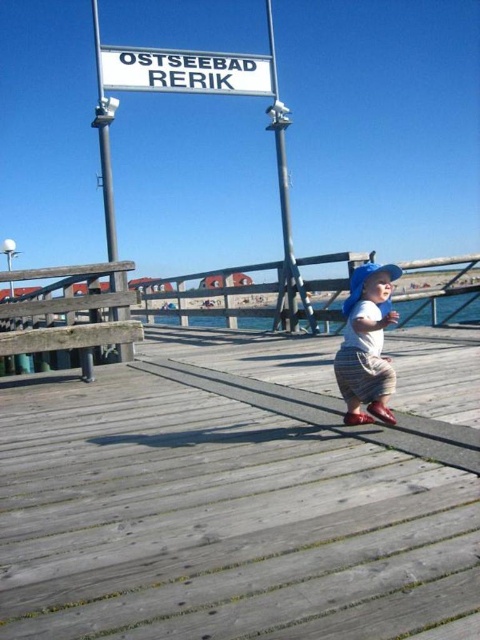
You are a visitor at Ostseebad Rerik and want to locate the entrance to the beach area. You notice the white plastic sign at upper center and the metallic gray pole at upper center. Which object is shorter and could indicate the direction to the entrance?

The white plastic sign at upper center has a lesser height compared to the metallic gray pole at upper center, so the white plastic sign at upper center is shorter and might indicate the direction to the entrance.